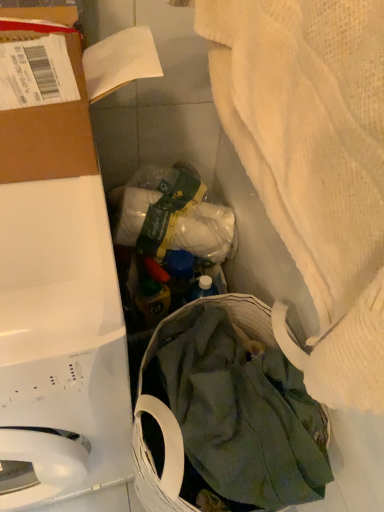
Question: From a real-world perspective, is white fabric at center on top of white glossy washing machine at left?

Choices:
 (A) no
 (B) yes

Answer: (B)

Question: Can you confirm if white fabric at center is shorter than white glossy washing machine at left?

Choices:
 (A) yes
 (B) no

Answer: (A)

Question: Would you say white glossy washing machine at left is part of white fabric at center's contents?

Choices:
 (A) no
 (B) yes

Answer: (A)

Question: Does white fabric at center have a smaller size compared to white glossy washing machine at left?

Choices:
 (A) no
 (B) yes

Answer: (B)

Question: Is white fabric at center aimed at white glossy washing machine at left?

Choices:
 (A) yes
 (B) no

Answer: (B)

Question: In terms of width, does white textured towel at upper right look wider or thinner when compared to green cotton cloth at lower center?

Choices:
 (A) thin
 (B) wide

Answer: (A)

Question: Considering the positions of white textured towel at upper right and green cotton cloth at lower center in the image, is white textured towel at upper right bigger or smaller than green cotton cloth at lower center?

Choices:
 (A) small
 (B) big

Answer: (A)

Question: In the image, is white textured towel at upper right on the left side or the right side of green cotton cloth at lower center?

Choices:
 (A) right
 (B) left

Answer: (A)

Question: Is white textured towel at upper right spatially inside green cotton cloth at lower center, or outside of it?

Choices:
 (A) inside
 (B) outside

Answer: (B)

Question: Looking at the image, does brown cardboard at upper left seem bigger or smaller compared to green cotton cloth at lower center?

Choices:
 (A) big
 (B) small

Answer: (B)

Question: From their relative heights in the image, would you say brown cardboard at upper left is taller or shorter than green cotton cloth at lower center?

Choices:
 (A) short
 (B) tall

Answer: (A)

Question: From the image's perspective, is brown cardboard at upper left located above or below green cotton cloth at lower center?

Choices:
 (A) above
 (B) below

Answer: (A)

Question: Relative to green cotton cloth at lower center, is brown cardboard at upper left in front or behind?

Choices:
 (A) front
 (B) behind

Answer: (A)

Question: Looking at their shapes, would you say brown cardboard at upper left is wider or thinner than white textured towel at upper right?

Choices:
 (A) wide
 (B) thin

Answer: (A)

Question: From the image's perspective, is brown cardboard at upper left positioned above or below white textured towel at upper right?

Choices:
 (A) above
 (B) below

Answer: (A)